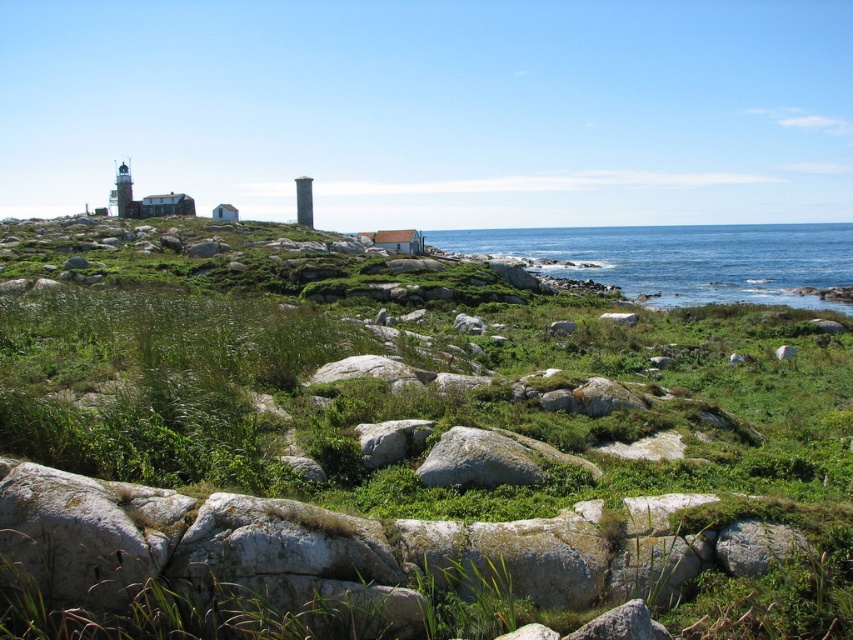
Question: Is gray rough rock at center above white painted metal lighthouse at left?

Choices:
 (A) no
 (B) yes

Answer: (A)

Question: Does gray rough rock at center appear on the left side of white painted metal lighthouse at left?

Choices:
 (A) yes
 (B) no

Answer: (B)

Question: Which object is positioned farthest from the green mossy rock at center-right?

Choices:
 (A) gray stone tower at center
 (B) white painted metal lighthouse at left

Answer: (B)

Question: Which of the following is the closest to the observer?

Choices:
 (A) (305, 211)
 (B) (126, 196)
 (C) (795, 349)

Answer: (C)

Question: Observing the image, what is the correct spatial positioning of gray rough rock at center in reference to white painted metal lighthouse at left?

Choices:
 (A) below
 (B) above

Answer: (A)

Question: Which point is farther from the camera taking this photo?

Choices:
 (A) (310, 177)
 (B) (122, 164)

Answer: (B)